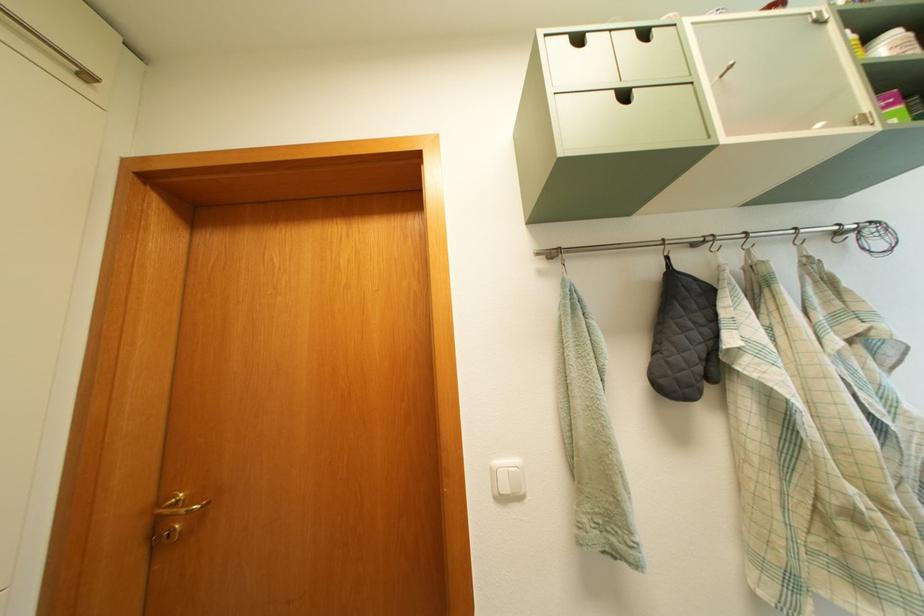
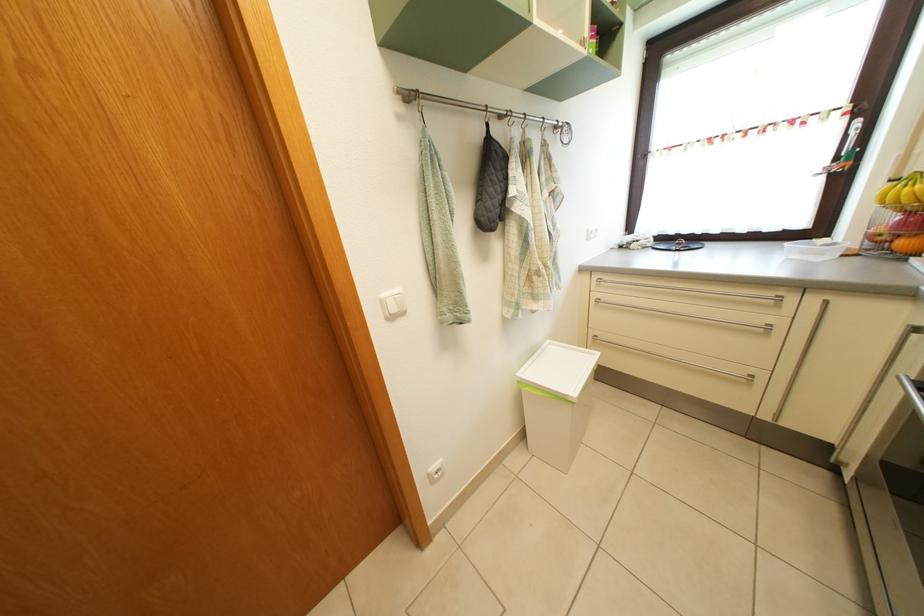
Find the pixel in the second image that matches point 505,469 in the first image.

(392, 302)